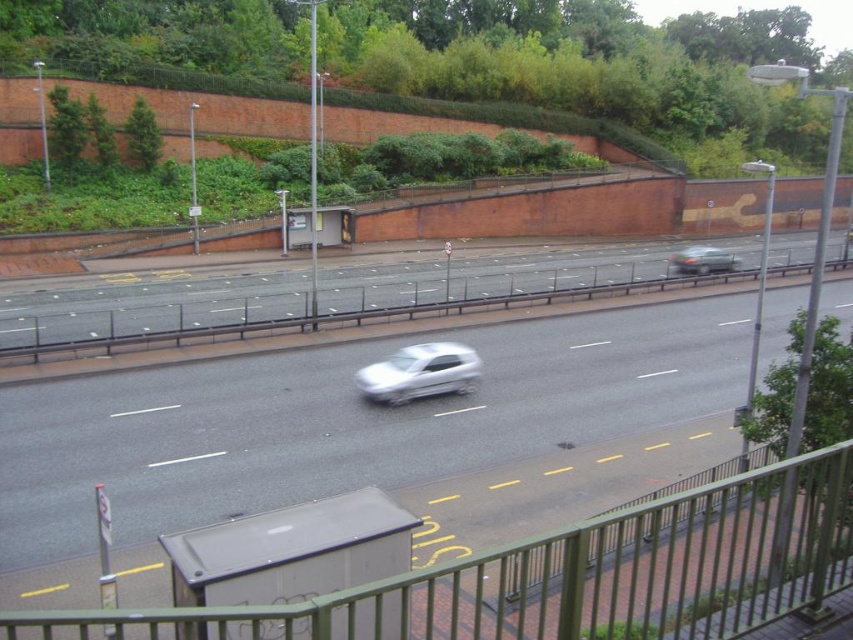
You are standing at the bus stop shelter and want to walk to the green metal fence at lower center marked by point (569, 576). Which direction should you go from the bus stop shelter to reach the green metal fence at lower center?

The point (569, 576) marks the green metal fence at lower center, so you should walk towards the lower center direction from the bus stop shelter to reach it.

In the scene shown: You are a pedestrian standing at the bus stop shelter. You need to cross the road to reach a store located behind the green metal fence at lower center. Which side of the smooth gray road at center should you look for a safe crossing point?

The green metal fence at lower center is positioned on the left side of the smooth gray road at center. Therefore, you should look for a safe crossing point on the left side of the smooth gray road at center to reach the store behind the green metal fence.

You are driving a white glossy car at center and want to switch lanes to the right to exit the highway. However, there is a green metallic car at right in your target lane. Based on the vehicles width, can you safely make this lane change without any collision?

The white glossy car at center is narrower than the green metallic car at right, so it is possible to safely change lanes without collision as long as there is sufficient space between the two vehicles.